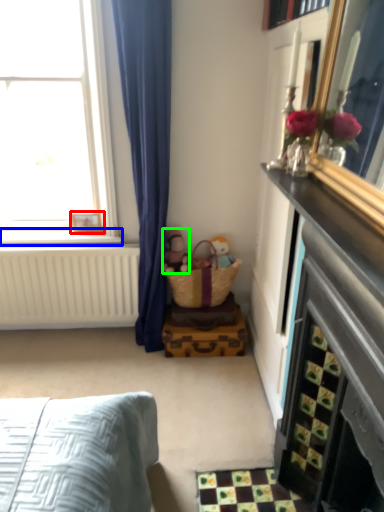
Question: Estimate the real-world distances between objects in this image. Which object is closer to picture frame (highlighted by a red box), window sill (highlighted by a blue box) or doll (highlighted by a green box)?

Choices:
 (A) window sill
 (B) doll

Answer: (A)